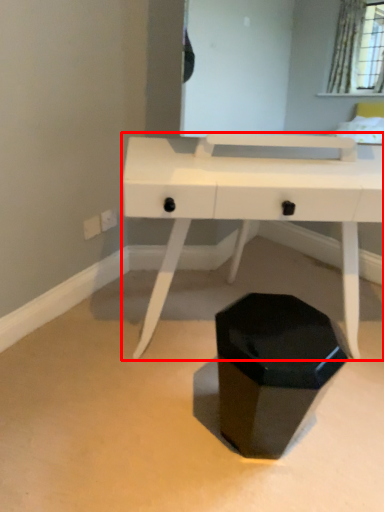
Question: From the image's perspective, what is the correct spatial relationship of desk (annotated by the red box) in relation to waste container?

Choices:
 (A) above
 (B) below

Answer: (A)